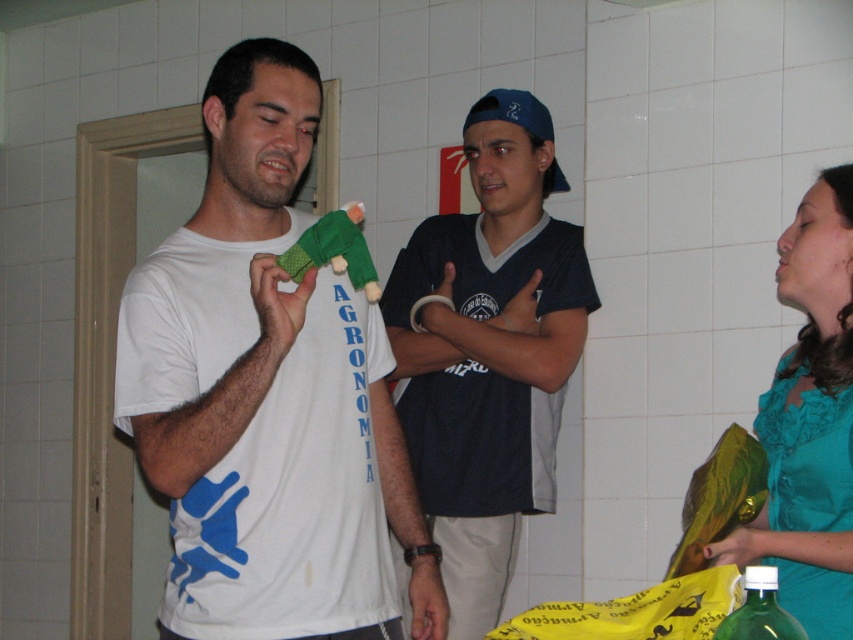
Question: Which object is positioned closest to the green matte bottle at lower right?

Choices:
 (A) dark blue jersey at center
 (B) teal satin blouse at right
 (C) white matte t-shirt at center
 (D) green fabric parrot at center

Answer: (B)

Question: Which of the following is the closest to the observer?

Choices:
 (A) (302, 243)
 (B) (494, 586)
 (C) (376, 579)

Answer: (A)

Question: Is teal satin blouse at right wider than green matte bottle at lower right?

Choices:
 (A) yes
 (B) no

Answer: (A)

Question: Is the position of teal satin blouse at right less distant than that of green matte bottle at lower right?

Choices:
 (A) yes
 (B) no

Answer: (B)

Question: Does white matte t-shirt at center come in front of green matte bottle at lower right?

Choices:
 (A) yes
 (B) no

Answer: (B)

Question: Which point is farther to the camera?

Choices:
 (A) (805, 230)
 (B) (456, 360)

Answer: (B)